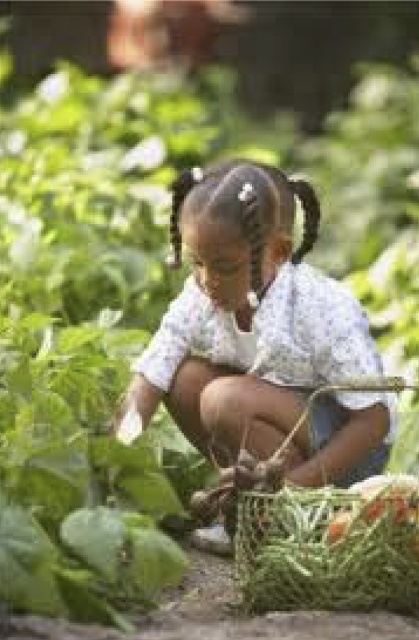
Question: Which object is the farthest from the green leafy vegetables at lower center?

Choices:
 (A) white floral shirt at center
 (B) green mesh basket at lower right

Answer: (A)

Question: Among these objects, which one is nearest to the camera?

Choices:
 (A) green leafy vegetables at lower center
 (B) green mesh basket at lower right

Answer: (B)

Question: Does green mesh basket at lower right have a greater width compared to green leafy vegetables at lower center?

Choices:
 (A) yes
 (B) no

Answer: (A)

Question: Does white floral shirt at center lie in front of green leafy vegetables at lower center?

Choices:
 (A) yes
 (B) no

Answer: (B)

Question: Which object appears closest to the camera in this image?

Choices:
 (A) white floral shirt at center
 (B) green mesh basket at lower right
 (C) green leafy vegetables at lower center

Answer: (B)

Question: Is white floral shirt at center above green mesh basket at lower right?

Choices:
 (A) no
 (B) yes

Answer: (B)